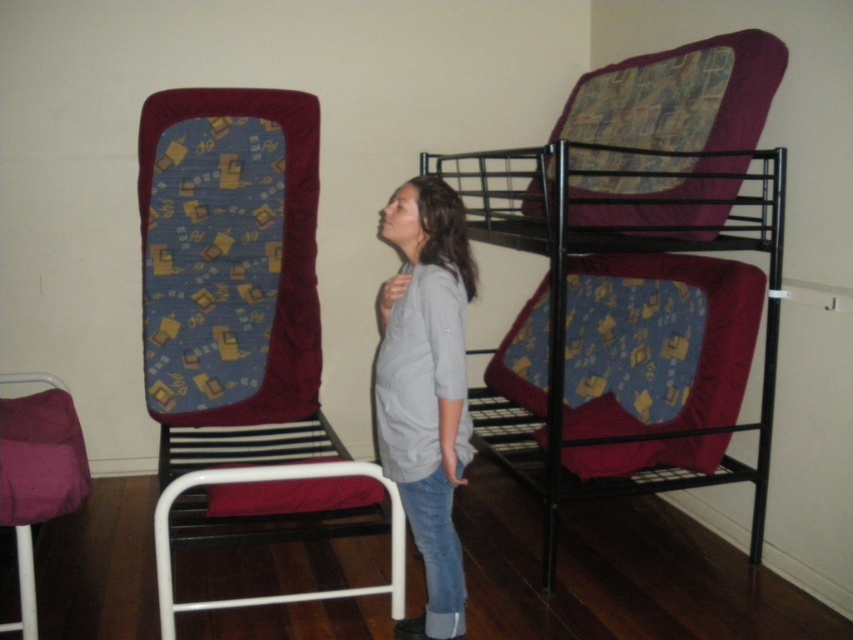
Question: Is maroon fabric bunk bed at right further to camera compared to purple fabric chair at lower left?

Choices:
 (A) no
 (B) yes

Answer: (B)

Question: Where is gray matte shirt at center located in relation to purple fabric chair at lower left in the image?

Choices:
 (A) below
 (B) above

Answer: (B)

Question: Among these objects, which one is farthest from the camera?

Choices:
 (A) gray matte shirt at center
 (B) purple fabric chair at lower left
 (C) blue fabric chair at left
 (D) maroon fabric bunk bed at right

Answer: (D)

Question: Does gray matte shirt at center appear on the right side of purple fabric chair at lower left?

Choices:
 (A) yes
 (B) no

Answer: (A)

Question: Which point is closer to the camera taking this photo?

Choices:
 (A) (16, 557)
 (B) (309, 445)
 (C) (691, 259)
 (D) (450, 452)

Answer: (D)

Question: Which object is closer to the camera taking this photo?

Choices:
 (A) maroon fabric bunk bed at right
 (B) blue fabric chair at left

Answer: (B)